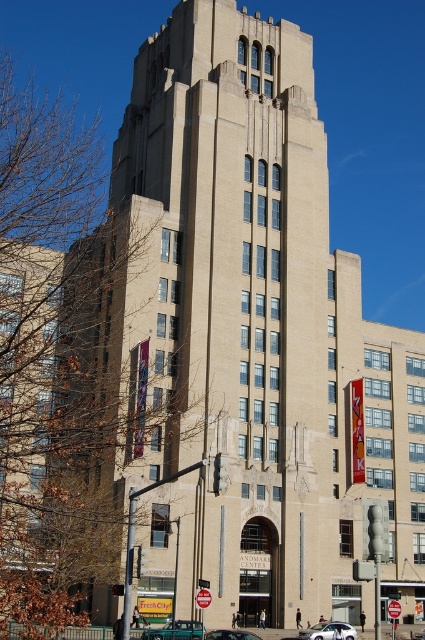
You are a delivery person trying to park your vehicle in a space that can only accommodate vehicles up to 2 meters wide. You see a metallic teal van at center and a metallic teal sedan at center in the parking area. Which vehicle should you choose to park in the space?

The metallic teal sedan at center should be chosen because its width is smaller than the metallic teal van at center, making it suitable for the 2 meter wide parking space.

You are a delivery driver who needs to park your silver metallic sedan at center in a parking spot located at coordinates 0.988, 0.772. Can you confirm if the sedan is already parked in the correct spot?

The silver metallic sedan at center is located at point (328, 632), so yes, it is parked in the correct spot.

You are a delivery person trying to park your metallic teal van at center in a parking spot that can only accommodate vehicles up to the width of the silver metallic sedan at center. Can your van fit in the parking spot?

The metallic teal van at center might be wider than the silver metallic sedan at center, so it may not fit in the parking spot designed for the sedan.